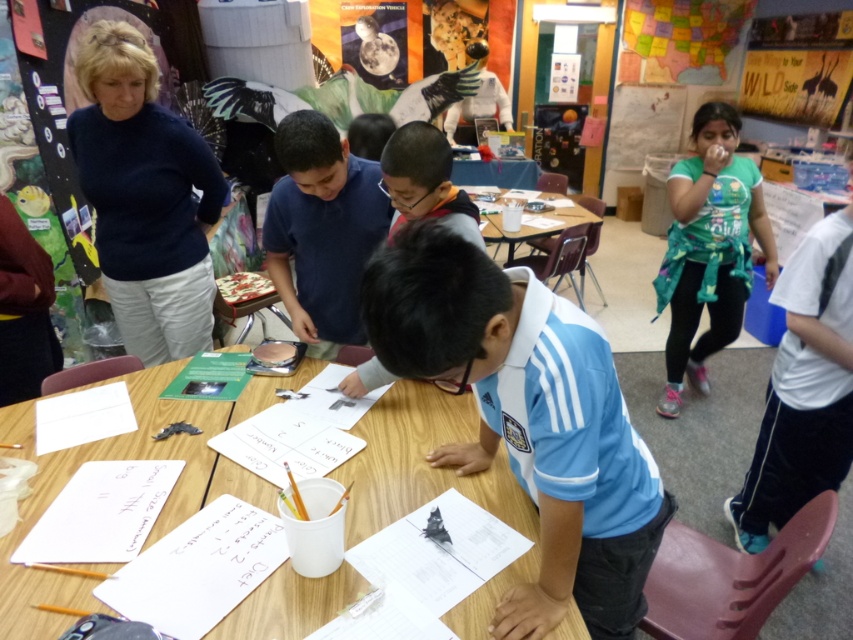
Is white matte paper at lower center bigger than white paper at lower left?

No, white matte paper at lower center is not bigger than white paper at lower left.

Who is shorter, white matte paper at lower center or white paper at lower left?

white matte paper at lower center

Which is behind, point (408, 540) or point (131, 417)?

The point (131, 417) is behind.

Where is `white matte paper at lower center`? The width and height of the screenshot is (853, 640). white matte paper at lower center is located at coordinates (439, 552).

Measure the distance between blue jersey at center and white paper at center.

A distance of 14.33 inches exists between blue jersey at center and white paper at center.

Is blue jersey at center shorter than white paper at center?

In fact, blue jersey at center may be taller than white paper at center.

Is point (436, 241) positioned after point (381, 468)?

No.

I want to click on blue jersey at center, so click(x=527, y=419).

Between blue cotton shirt at center and white paper at lower center, which one appears on the right side from the viewer's perspective?

blue cotton shirt at center

Is point (294, 252) farther from camera compared to point (183, 525)?

Yes, it is.

Locate an element on the screen. blue cotton shirt at center is located at coordinates (321, 228).